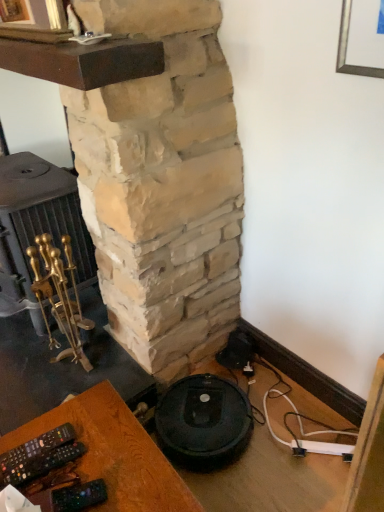
Question: Is natural stone fireplace at center far from black plastic remote control at lower left?

Choices:
 (A) yes
 (B) no

Answer: (B)

Question: Can you confirm if natural stone fireplace at center is taller than black plastic remote control at lower left?

Choices:
 (A) no
 (B) yes

Answer: (B)

Question: Considering the relative positions of natural stone fireplace at center and black plastic remote control at lower left in the image provided, is natural stone fireplace at center to the left of black plastic remote control at lower left from the viewer's perspective?

Choices:
 (A) no
 (B) yes

Answer: (B)

Question: Can you confirm if natural stone fireplace at center is smaller than black plastic remote control at lower left?

Choices:
 (A) no
 (B) yes

Answer: (A)

Question: Could you tell me if natural stone fireplace at center is facing black plastic remote control at lower left?

Choices:
 (A) yes
 (B) no

Answer: (B)

Question: Is natural stone fireplace at center directly adjacent to black plastic remote control at lower left?

Choices:
 (A) no
 (B) yes

Answer: (A)

Question: Does natural stone fireplace at center touch gold polished fireplace tools at left?

Choices:
 (A) yes
 (B) no

Answer: (B)

Question: Is natural stone fireplace at center aimed at gold polished fireplace tools at left?

Choices:
 (A) no
 (B) yes

Answer: (B)

Question: Can you confirm if natural stone fireplace at center is bigger than gold polished fireplace tools at left?

Choices:
 (A) no
 (B) yes

Answer: (B)

Question: Are natural stone fireplace at center and gold polished fireplace tools at left far apart?

Choices:
 (A) no
 (B) yes

Answer: (A)

Question: Can you confirm if natural stone fireplace at center is taller than gold polished fireplace tools at left?

Choices:
 (A) yes
 (B) no

Answer: (A)

Question: From the image's perspective, is natural stone fireplace at center over gold polished fireplace tools at left?

Choices:
 (A) no
 (B) yes

Answer: (B)

Question: Is gold polished fireplace tools at left to the right of black plastic remote control at lower left from the viewer's perspective?

Choices:
 (A) no
 (B) yes

Answer: (A)